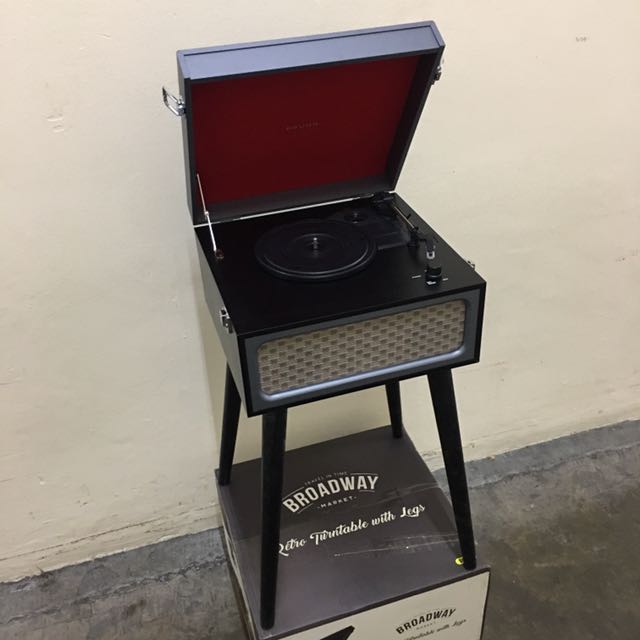
Identify the location of hinge. Image resolution: width=640 pixels, height=640 pixels. (212, 221).